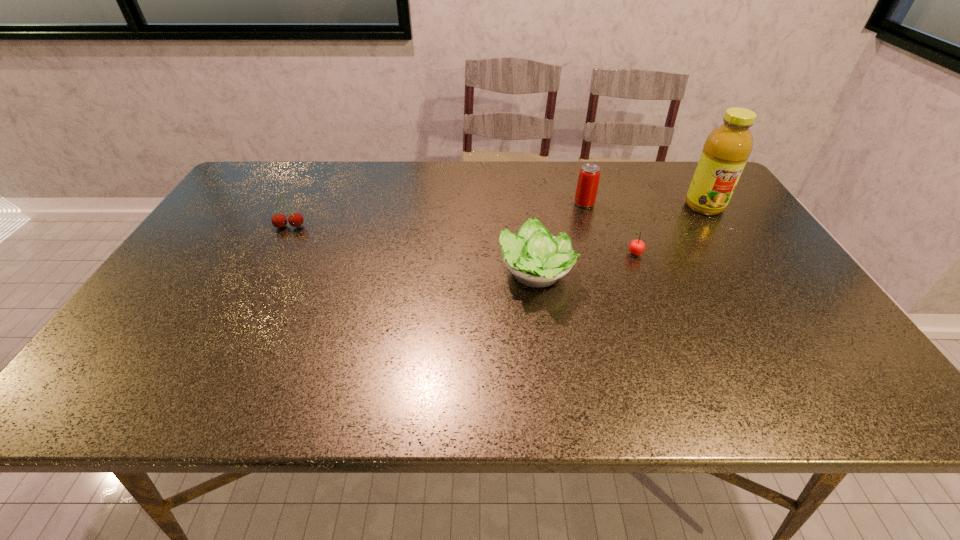
Locate an element on the screen. Image resolution: width=960 pixels, height=540 pixels. fruit juice is located at coordinates (726, 150).

Identify the location of the rightmost object. (726, 150).

Locate an element on the screen. This screenshot has width=960, height=540. beer can is located at coordinates (587, 186).

In order to click on the leftmost object in this screenshot , I will do `click(296, 219)`.

Where is `the farther cherry`? The height and width of the screenshot is (540, 960). the farther cherry is located at coordinates (296, 219).

Identify the location of the fourth object from right to left. The image size is (960, 540). (536, 258).

Locate an element on the screen. This screenshot has width=960, height=540. the fourth object from left to right is located at coordinates (636, 247).

This screenshot has height=540, width=960. Identify the location of the shorter cherry. (636, 247).

I want to click on vacant position located on the front label of the tallest object, so click(x=732, y=247).

In order to click on vacant region located 0.360m on the right of the beer can in this screenshot , I will do `click(711, 204)`.